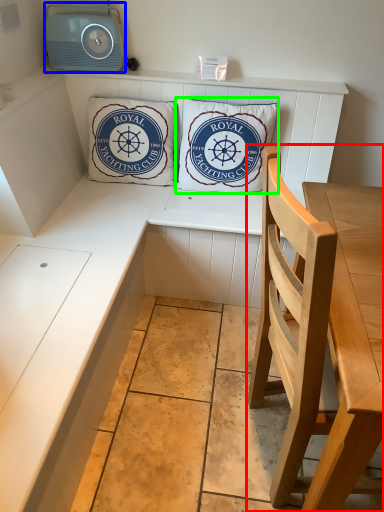
Question: Estimate the real-world distances between objects in this image. Which object is farther from chair (highlighted by a red box), stereo (highlighted by a blue box) or pillow (highlighted by a green box)?

Choices:
 (A) stereo
 (B) pillow

Answer: (A)